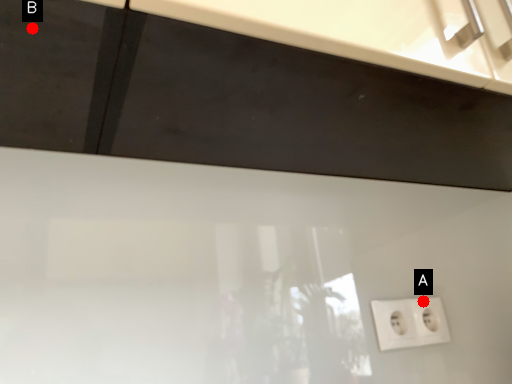
Question: Two points are circled on the image, labeled by A and B beside each circle. Among these points, which one is nearest to the camera?

Choices:
 (A) A is closer
 (B) B is closer

Answer: (B)